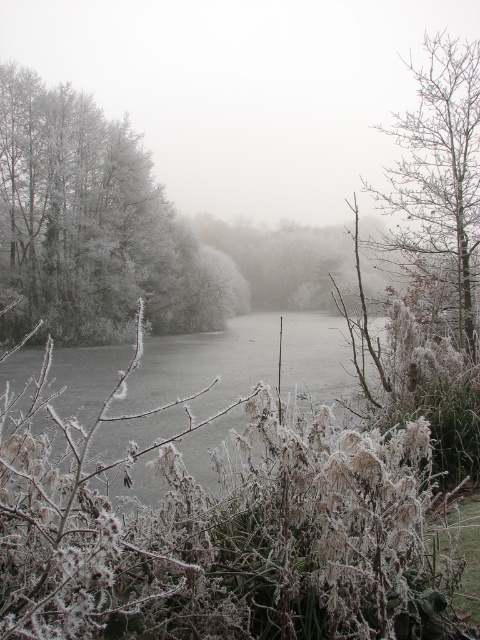
You are standing in the winter scene and want to take a closer look at both the frosted ice at center and the frosty bark tree at right. Which object will you reach first as you move forward?

You will reach the frosted ice at center first because it is closer to the viewer than the frosty bark tree at right.

You are standing in the winter scene and want to walk from the frosted white trees at left to the frosty bark tree at right. Which direction should you head?

You should head to the right because the frosted white trees at left is to the left of the frosty bark tree at right.